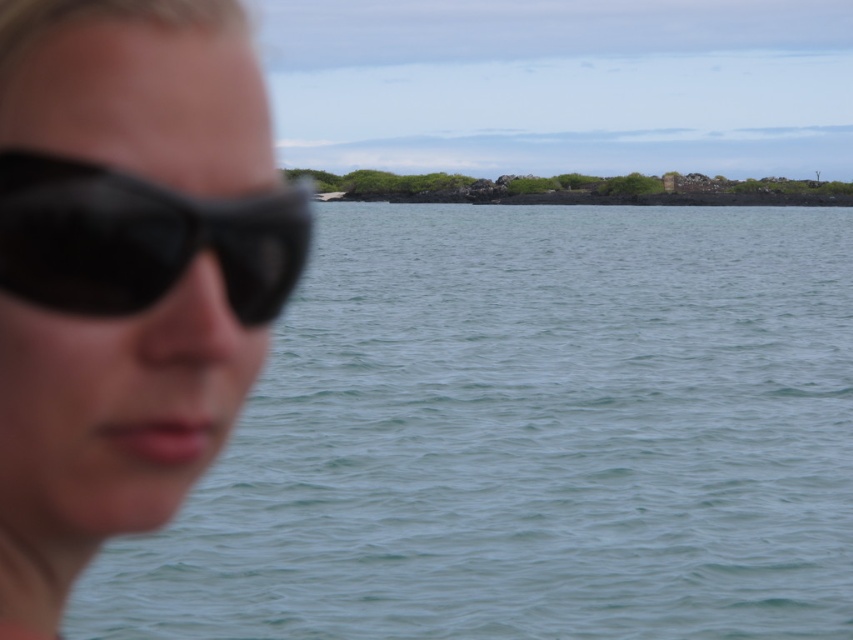
You are a photographer trying to capture the landscape in the background. You notice two pairs of sunglasses labeled matte black sunglasses at left and black matte sunglasses at left. Which pair is closer to you?

The matte black sunglasses at left is closer to you because it is in front of the black matte sunglasses at left.

You are a photographer trying to capture the landscape in the background. You notice two pairs of sunglasses on the person at the left side of the scene. Which pair of sunglasses would block more light if worn, the matte black sunglasses at left or the black matte sunglasses at left?

The matte black sunglasses at left has a larger size compared to black matte sunglasses at left, so it would block more light when worn.